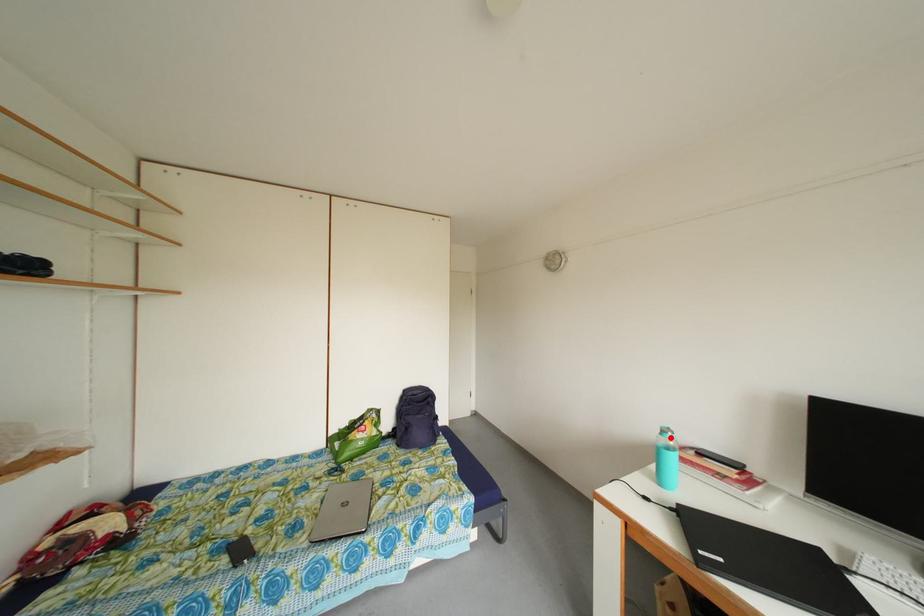
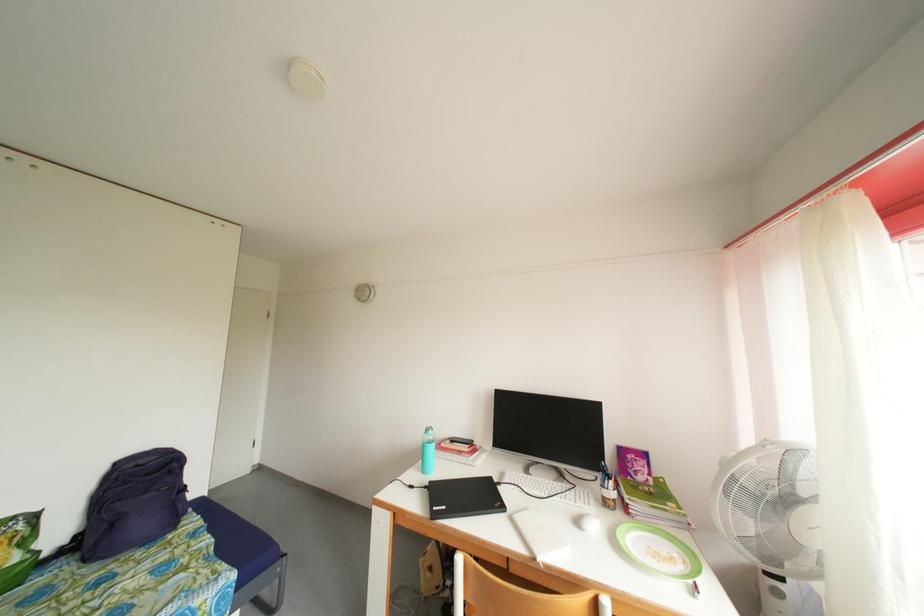
Find the pixel in the second image that matches the highlighted location in the first image.

(434, 436)